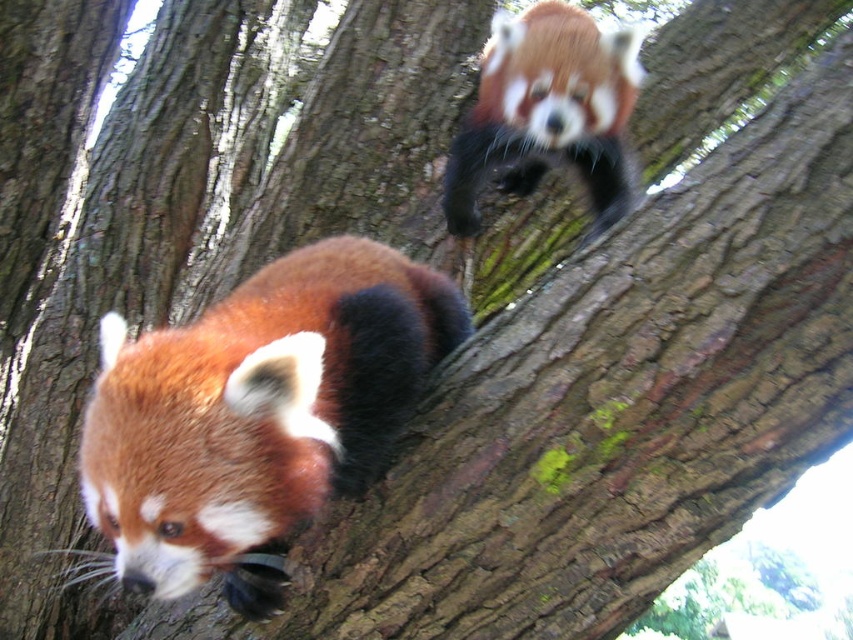
Question: Is fluffy reddish-brown fur at lower left bigger than fluffy reddish-brown fur at upper center?

Choices:
 (A) yes
 (B) no

Answer: (A)

Question: Does fluffy reddish-brown fur at lower left have a greater width compared to fluffy reddish-brown fur at upper center?

Choices:
 (A) no
 (B) yes

Answer: (B)

Question: Which point is farther from the camera taking this photo?

Choices:
 (A) (403, 332)
 (B) (590, 106)

Answer: (B)

Question: Is fluffy reddish-brown fur at lower left positioned at the back of fluffy reddish-brown fur at upper center?

Choices:
 (A) yes
 (B) no

Answer: (B)

Question: Which point is closer to the camera?

Choices:
 (A) fluffy reddish-brown fur at upper center
 (B) fluffy reddish-brown fur at lower left

Answer: (B)